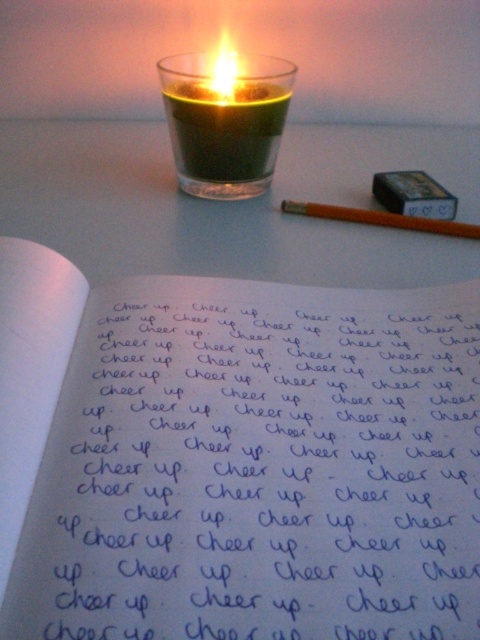
Does green glass at center have a smaller size compared to translucent glass candle at upper center?

Yes, green glass at center is smaller than translucent glass candle at upper center.

Can you confirm if green glass at center is positioned below translucent glass candle at upper center?

Indeed, green glass at center is positioned under translucent glass candle at upper center.

Where is `green glass at center`? green glass at center is located at coordinates (225, 120).

Where is `green glass at center`? green glass at center is located at coordinates (225, 120).

Does green glass at center have a greater width compared to orange wood pencil at upper right?

No, green glass at center is not wider than orange wood pencil at upper right.

Identify the location of green glass at center. coord(225,120).

Which is behind, point (260, 96) or point (367, 220)?

Point (260, 96)

Identify the location of green glass at center. (225, 120).

Can you confirm if orange wood pencil at upper right is positioned to the left of translucent glass candle at upper center?

In fact, orange wood pencil at upper right is to the right of translucent glass candle at upper center.

You are a GUI agent. You are given a task and a screenshot of the screen. Output one action in this format:
    pyautogui.click(x=<x>, y=<y>)
    Task: Click on the orange wood pencil at upper right
    This screenshot has height=640, width=480.
    Given the screenshot: What is the action you would take?
    click(x=382, y=218)

Identify the location of orange wood pencil at upper right. The image size is (480, 640). (382, 218).